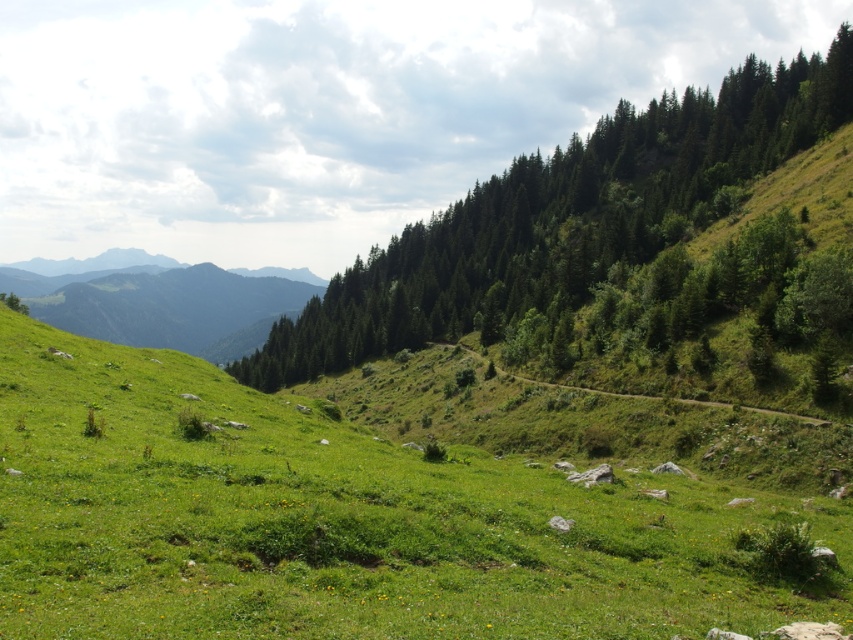
Question: Does green grassy at center appear over green grassy mountain at upper left?

Choices:
 (A) yes
 (B) no

Answer: (B)

Question: Considering the real-world distances, which object is farthest from the green textured trees at upper right?

Choices:
 (A) green grassy at center
 (B) green grassy mountain at upper left

Answer: (B)

Question: Does green grassy at center have a larger size compared to green grassy mountain at upper left?

Choices:
 (A) no
 (B) yes

Answer: (A)

Question: Which point is farther to the camera?

Choices:
 (A) (694, 100)
 (B) (35, 296)

Answer: (B)

Question: Considering the relative positions of green grassy at center and green grassy mountain at upper left in the image provided, where is green grassy at center located with respect to green grassy mountain at upper left?

Choices:
 (A) below
 (B) above

Answer: (A)

Question: Which of the following is the closest to the observer?

Choices:
 (A) green textured trees at upper right
 (B) green grassy mountain at upper left

Answer: (A)